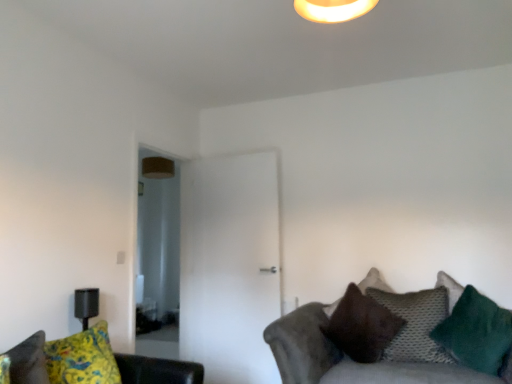
Question: From a real-world perspective, is knitted gray pillow at lower right, which appears as the second pillow when viewed from the back, physically below brown suede pillow at lower right, which is counted as the 1th pillow, starting from the back?

Choices:
 (A) yes
 (B) no

Answer: (A)

Question: Does knitted gray pillow at lower right, which appears as the second pillow when viewed from the back, have a larger size compared to brown suede pillow at lower right, which is counted as the 1th pillow, starting from the back?

Choices:
 (A) yes
 (B) no

Answer: (B)

Question: From a real-world perspective, is knitted gray pillow at lower right, which appears as the second pillow when viewed from the back, on top of brown suede pillow at lower right, placed as the 3th pillow when sorted from front to back?

Choices:
 (A) no
 (B) yes

Answer: (A)

Question: Can you confirm if knitted gray pillow at lower right, acting as the second pillow starting from the front, is smaller than brown suede pillow at lower right, placed as the 3th pillow when sorted from front to back?

Choices:
 (A) yes
 (B) no

Answer: (A)

Question: Does knitted gray pillow at lower right, acting as the second pillow starting from the front, appear on the right side of brown suede pillow at lower right, which is counted as the 1th pillow, starting from the back?

Choices:
 (A) no
 (B) yes

Answer: (B)

Question: Is green fuzzy pillow at right, the 1th pillow viewed from the front, in front of or behind knitted gray pillow at lower right, which appears as the second pillow when viewed from the back, in the image?

Choices:
 (A) front
 (B) behind

Answer: (A)

Question: Is green fuzzy pillow at right, acting as the third pillow starting from the back, wider or thinner than knitted gray pillow at lower right, acting as the second pillow starting from the front?

Choices:
 (A) wide
 (B) thin

Answer: (A)

Question: Is green fuzzy pillow at right, the 1th pillow viewed from the front, inside or outside of knitted gray pillow at lower right, which appears as the second pillow when viewed from the back?

Choices:
 (A) outside
 (B) inside

Answer: (A)

Question: From a real-world perspective, is green fuzzy pillow at right, acting as the third pillow starting from the back, above or below knitted gray pillow at lower right, which appears as the second pillow when viewed from the back?

Choices:
 (A) above
 (B) below

Answer: (A)

Question: From a real-world perspective, is brown suede pillow at lower right, which is counted as the 1th pillow, starting from the back, positioned above or below green fuzzy pillow at right, the 1th pillow viewed from the front?

Choices:
 (A) below
 (B) above

Answer: (B)

Question: Is point (374, 327) closer or farther from the camera than point (480, 299)?

Choices:
 (A) farther
 (B) closer

Answer: (A)

Question: Would you say brown suede pillow at lower right, which is counted as the 1th pillow, starting from the back, is inside or outside green fuzzy pillow at right, the 1th pillow viewed from the front?

Choices:
 (A) inside
 (B) outside

Answer: (B)

Question: Looking at their shapes, would you say brown suede pillow at lower right, placed as the 3th pillow when sorted from front to back, is wider or thinner than green fuzzy pillow at right, the 1th pillow viewed from the front?

Choices:
 (A) wide
 (B) thin

Answer: (A)

Question: From the image's perspective, is textured gray couch at lower right, the first studio couch viewed from the right, located above or below yellow fabric couch at lower left, marked as the 2th studio couch in a right-to-left arrangement?

Choices:
 (A) below
 (B) above

Answer: (A)

Question: Is textured gray couch at lower right, the first studio couch viewed from the right, taller or shorter than yellow fabric couch at lower left, marked as the 2th studio couch in a right-to-left arrangement?

Choices:
 (A) tall
 (B) short

Answer: (A)